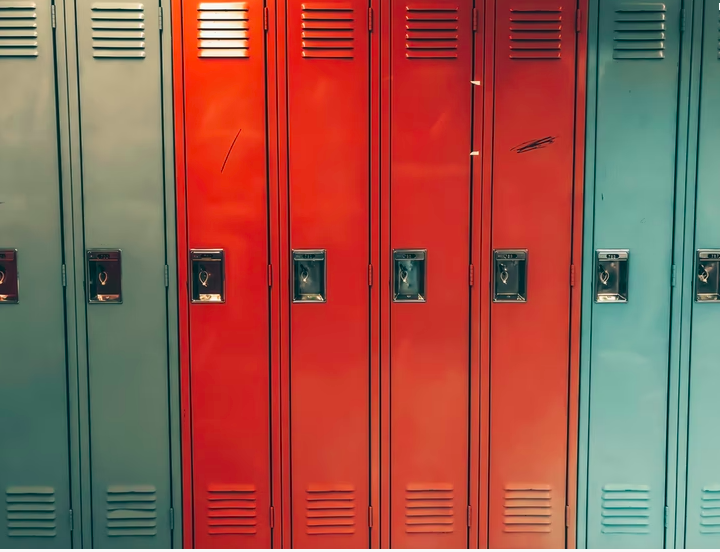
Locate an element on the screen. light blue lockers is located at coordinates (626, 155), (710, 152).